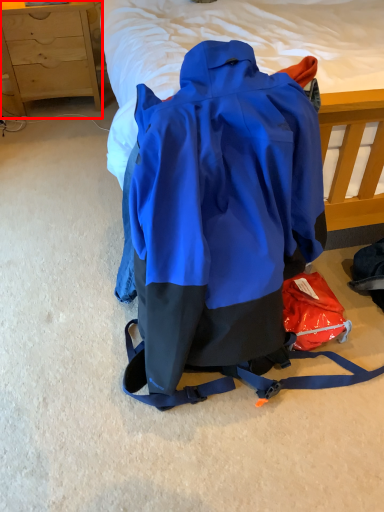
Question: Observing the image, what is the correct spatial positioning of chest of drawers (annotated by the red box) in reference to backpack?

Choices:
 (A) right
 (B) left

Answer: (B)